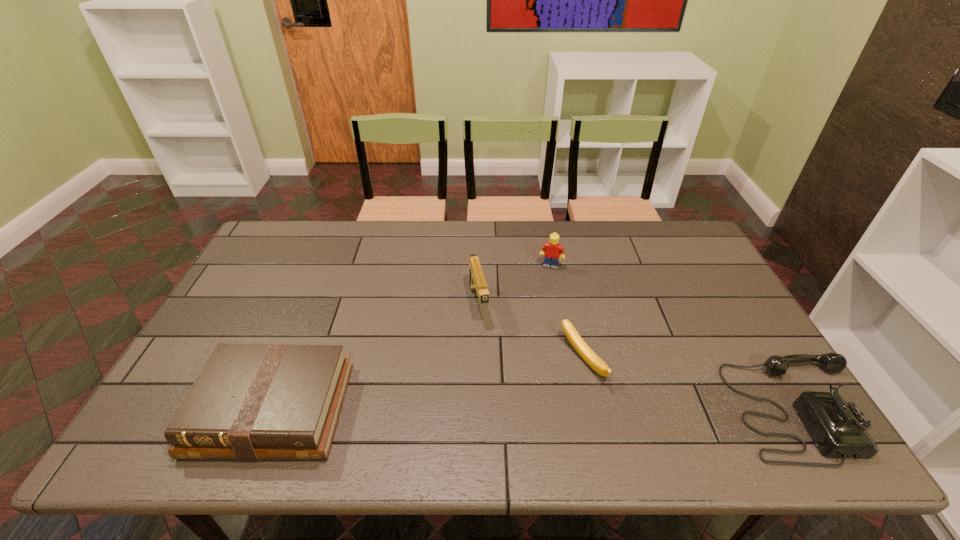
Locate an element on the screen. This screenshot has width=960, height=540. object that is at the right edge is located at coordinates (838, 428).

Locate an element on the screen. This screenshot has width=960, height=540. object that is at the near left corner is located at coordinates point(251,401).

Find the location of `object that is at the near right corner`. object that is at the near right corner is located at coordinates (838, 428).

Image resolution: width=960 pixels, height=540 pixels. In the image, there is a desktop. In order to click on vacant space at the far edge in this screenshot , I will do `click(377, 237)`.

Identify the location of vacant space at the near edge of the desktop. This screenshot has height=540, width=960. (359, 397).

In the image, there is a desktop. Where is `vacant space at the left edge`? This screenshot has width=960, height=540. vacant space at the left edge is located at coordinates (265, 299).

In the image, there is a desktop. Where is `vacant space at the right edge`? This screenshot has height=540, width=960. vacant space at the right edge is located at coordinates (769, 383).

The height and width of the screenshot is (540, 960). What are the coordinates of `vacant space at the far right corner` in the screenshot? It's located at (652, 239).

What are the coordinates of `vacant point located between the pistol and the Lego` in the screenshot? It's located at (515, 285).

The width and height of the screenshot is (960, 540). Identify the location of vacant area that lies between the farthest object and the second object from left to right. (515, 285).